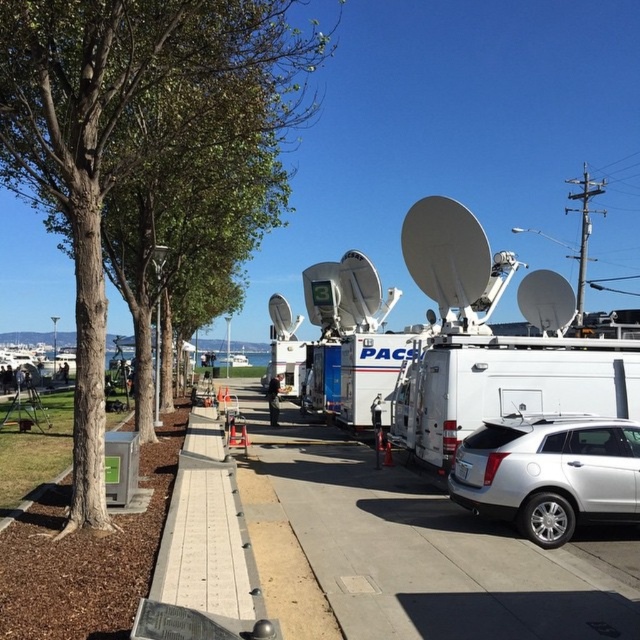
Does green leafy tree at center have a lesser width compared to gray concrete sidewalk at center?

In fact, green leafy tree at center might be wider than gray concrete sidewalk at center.

Between green leafy tree at center and gray concrete sidewalk at center, which one has more height?

green leafy tree at center

Who is more distant from viewer, (113, 104) or (400, 573)?

Positioned behind is point (113, 104).

I want to click on green leafy tree at center, so click(x=124, y=132).

Does gray concrete sidewalk at center have a greater height compared to silver metallic suv at lower right?

No.

Between gray concrete sidewalk at center and silver metallic suv at lower right, which one is positioned higher?

silver metallic suv at lower right is above.

Does point (568, 614) come farther from viewer compared to point (552, 436)?

No.

Locate an element on the screen. gray concrete sidewalk at center is located at coordinates (428, 547).

Is green leafy tree at center closer to the viewer compared to silver metallic suv at lower right?

Yes, green leafy tree at center is closer to the viewer.

Does green leafy tree at center lie behind silver metallic suv at lower right?

No, it is not.

Find the location of `green leafy tree at center`. green leafy tree at center is located at coordinates (124, 132).